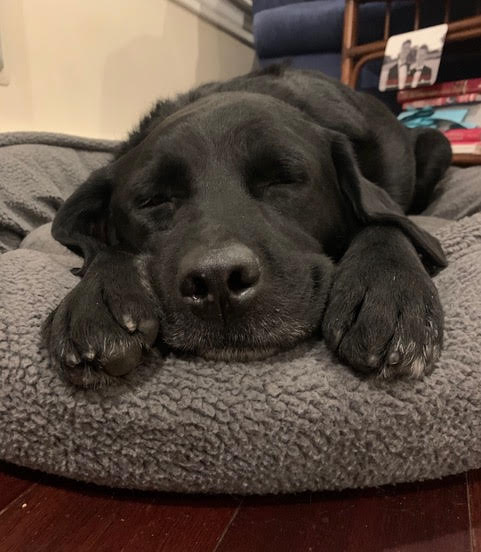
Where is `puppy's bed`? Image resolution: width=481 pixels, height=552 pixels. puppy's bed is located at coordinates (361, 438).